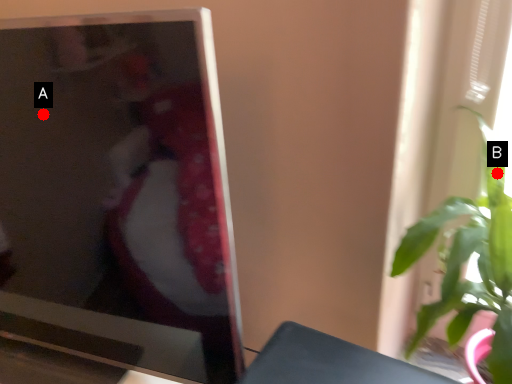
Question: Two points are circled on the image, labeled by A and B beside each circle. Which point is closer to the camera?

Choices:
 (A) A is closer
 (B) B is closer

Answer: (A)